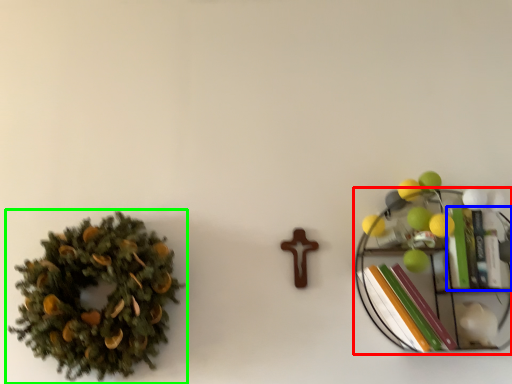
Question: Estimate the real-world distances between objects in this image. Which object is closer to shelf (highlighted by a red box), book (highlighted by a blue box) or houseplant (highlighted by a green box)?

Choices:
 (A) book
 (B) houseplant

Answer: (A)